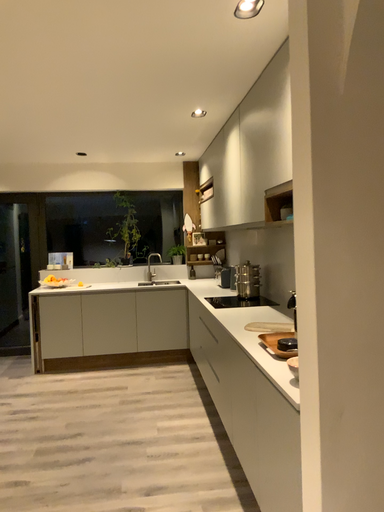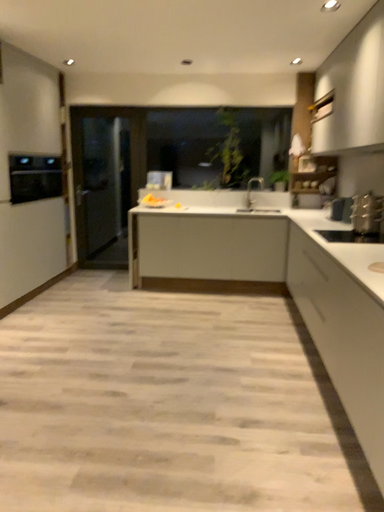
Question: How did the camera likely rotate when shooting the video?

Choices:
 (A) rotated left
 (B) rotated right

Answer: (A)